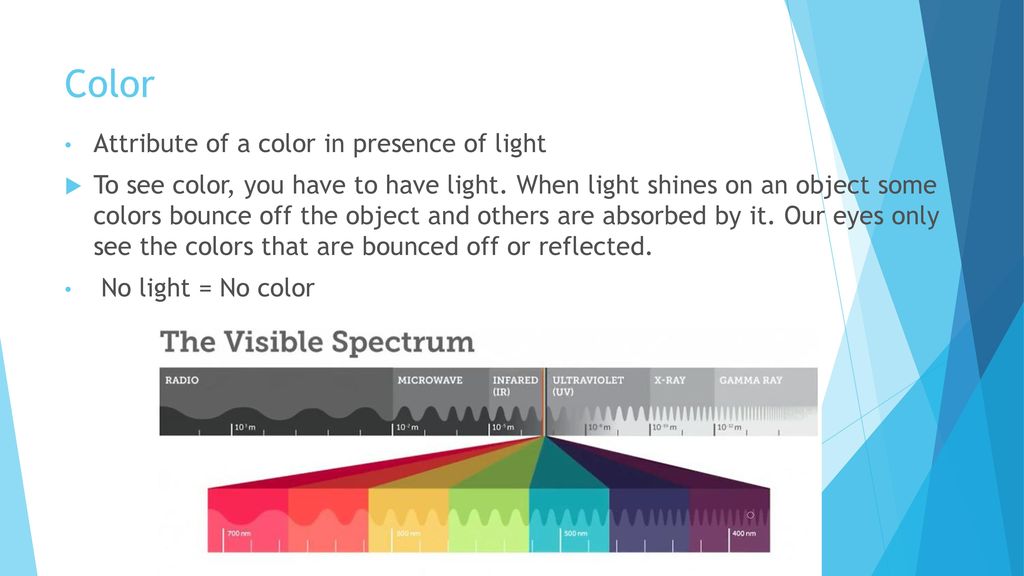
Locate an element on the screen. This screenshot has height=576, width=1024. ultraviolet section of bar is located at coordinates (612, 406).